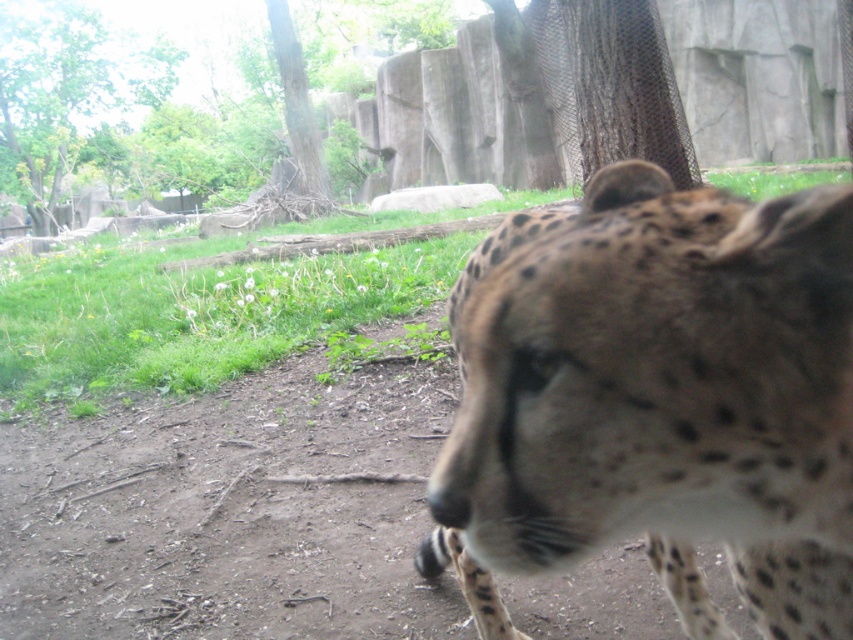
You are a zookeeper observing the enclosure. You need to place a new feeding tray between the spotted fur cheetah at center and the green leafy tree at upper left. Based on their positions, which object should the feeding tray be closer to?

The feeding tray should be placed closer to the green leafy tree at upper left because the spotted fur cheetah at center is positioned to the right of the tree.

You are a zookeeper standing in front of the cheetah enclosure. You notice two points marked in the image. The first point is at coordinate point (804,634) and the second is at point (161,64). Which point is closer to you?

Point (804,634) is closer to the camera than point (161,64), so the first point is closer to you.

You are a wildlife photographer standing in the zoo enclosure with the spotted fur cheetah at center and the green leafy tree at upper left in view. You want to capture a photo where both the cheetah and the tree are in focus. Based on their distance apart, is it possible to achieve this with a standard camera lens? Explain your reasoning.

The spotted fur cheetah at center and the green leafy tree at upper left are 26.19 meters apart. With a standard camera lens, achieving focus on both subjects at such a distance would be challenging because the depth of field becomes shallower as the distance increases, making it difficult to keep both the foreground cheetah and the distant tree in sharp focus simultaneously.